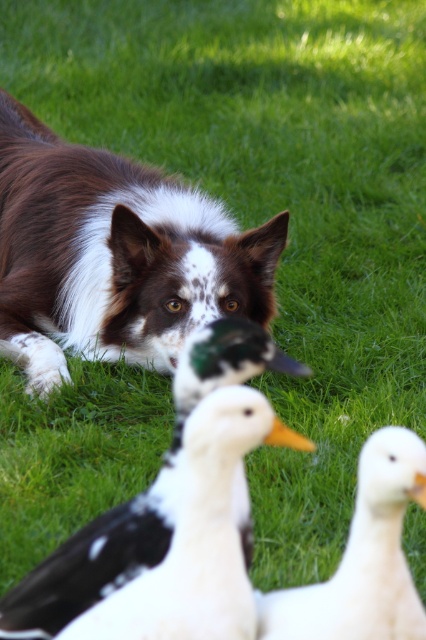
Which of these two, brown speckled fur at upper left or white matte goose at lower right, stands taller?

Standing taller between the two is brown speckled fur at upper left.

Who is shorter, brown speckled fur at upper left or white matte goose at lower right?

Standing shorter between the two is white matte goose at lower right.

Image resolution: width=426 pixels, height=640 pixels. What are the coordinates of `brown speckled fur at upper left` in the screenshot? It's located at (114, 256).

The height and width of the screenshot is (640, 426). I want to click on brown speckled fur at upper left, so click(114, 256).

Can you confirm if brown speckled fur at upper left is positioned to the right of white matte goose at center?

In fact, brown speckled fur at upper left is to the left of white matte goose at center.

Who is more distant from viewer, (141,244) or (222,403)?

The point (141,244) is more distant.

This screenshot has width=426, height=640. I want to click on brown speckled fur at upper left, so click(114, 256).

Which is behind, point (236, 540) or point (408, 616)?

The point (236, 540) is behind.

Is white matte goose at center to the right of white matte goose at lower right from the viewer's perspective?

Incorrect, white matte goose at center is not on the right side of white matte goose at lower right.

Is point (235, 604) closer to viewer compared to point (337, 625)?

No, (235, 604) is behind (337, 625).

At what (x,y) coordinates should I click in order to perform the action: click on white matte goose at center. Please return your answer as a coordinate pair (x, y). This screenshot has height=640, width=426. Looking at the image, I should click on (198, 536).